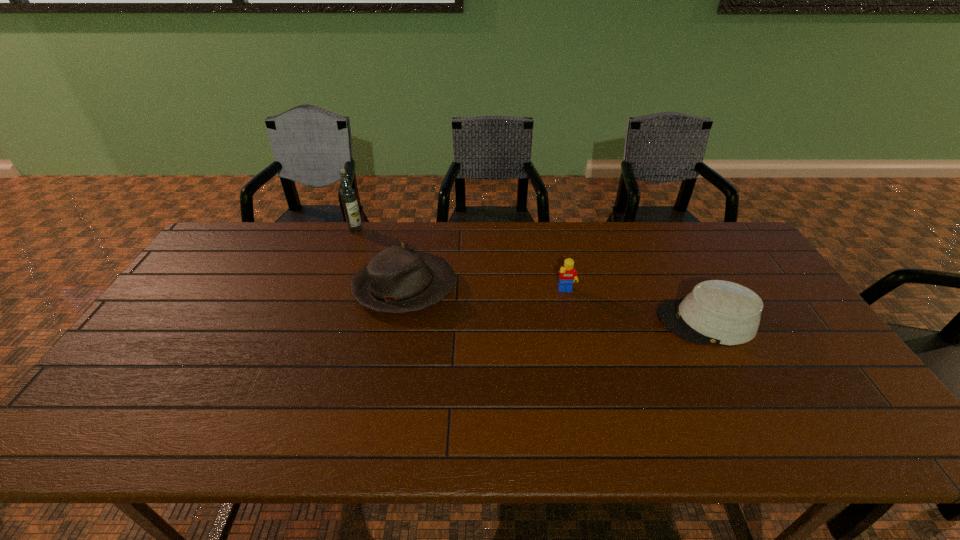
Identify the location of object that stands as the third closest to the Lego. (348, 195).

Locate an element on the screen. object that is the second closest to the third object from left to right is located at coordinates (396, 280).